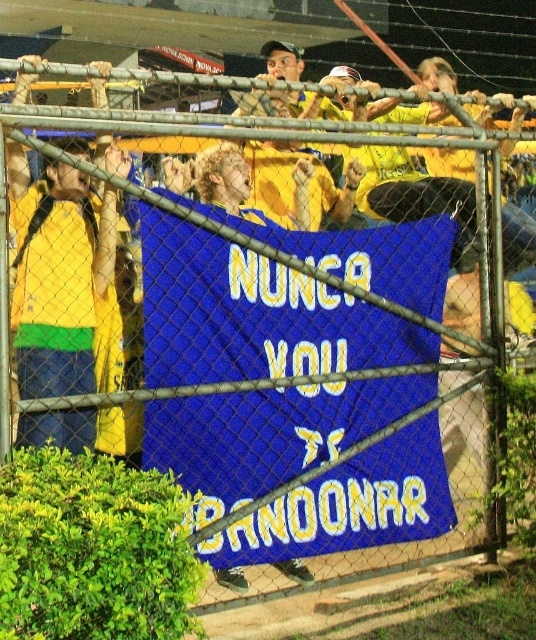
Is blue fabric banner at center shorter than matte yellow jersey at left?

Correct, blue fabric banner at center is not as tall as matte yellow jersey at left.

Can you confirm if blue fabric banner at center is taller than matte yellow jersey at left?

In fact, blue fabric banner at center may be shorter than matte yellow jersey at left.

Describe the element at coordinates (254, 314) in the screenshot. The image size is (536, 640). I see `blue fabric banner at center` at that location.

The height and width of the screenshot is (640, 536). I want to click on blue fabric banner at center, so click(x=254, y=314).